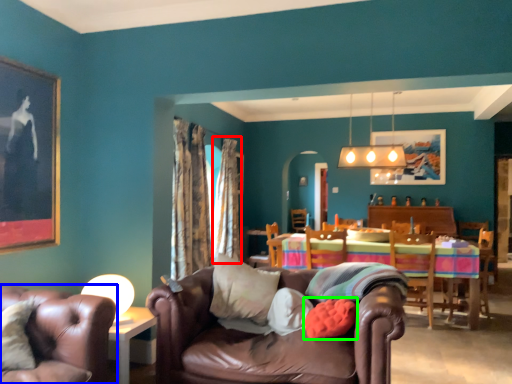
Question: Based on their relative distances, which object is farther from curtain (highlighted by a red box)? Choose from chair (highlighted by a blue box) and pillow (highlighted by a green box).

Choices:
 (A) chair
 (B) pillow

Answer: (A)